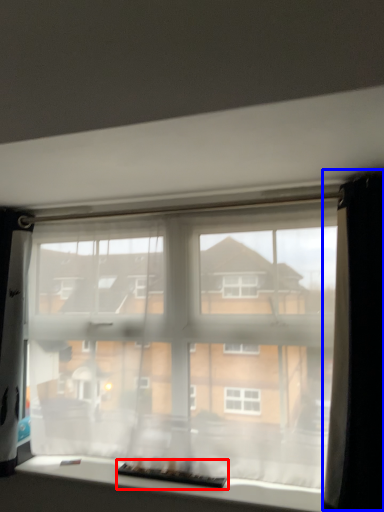
Question: Among these objects, which one is farthest to the camera, level (highlighted by a red box) or curtain (highlighted by a blue box)?

Choices:
 (A) level
 (B) curtain

Answer: (A)